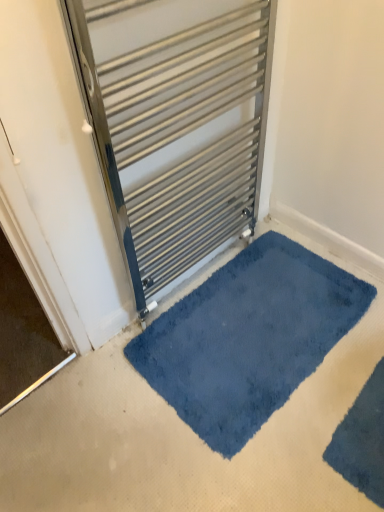
Question: Is velvety blue bath mat at lower right, which is the 1th bath mat from front to back, to the left of blue plush bath mat at center, which appears as the 1th bath mat when viewed from the back, from the viewer's perspective?

Choices:
 (A) yes
 (B) no

Answer: (B)

Question: Is blue plush bath mat at center, which appears as the 1th bath mat when viewed from the back, completely or partially inside velvety blue bath mat at lower right, which is the 1th bath mat from front to back?

Choices:
 (A) yes
 (B) no

Answer: (B)

Question: Can you confirm if velvety blue bath mat at lower right, which is the 1th bath mat from front to back, is smaller than blue plush bath mat at center, which ranks as the second bath mat in front-to-back order?

Choices:
 (A) no
 (B) yes

Answer: (B)

Question: Is velvety blue bath mat at lower right, positioned as the 2th bath mat in back-to-front order, next to blue plush bath mat at center, which ranks as the second bath mat in front-to-back order?

Choices:
 (A) no
 (B) yes

Answer: (A)

Question: Is velvety blue bath mat at lower right, positioned as the 2th bath mat in back-to-front order, outside of blue plush bath mat at center, which appears as the 1th bath mat when viewed from the back?

Choices:
 (A) yes
 (B) no

Answer: (A)

Question: Considering the relative sizes of velvety blue bath mat at lower right, positioned as the 2th bath mat in back-to-front order, and blue plush bath mat at center, which appears as the 1th bath mat when viewed from the back, in the image provided, is velvety blue bath mat at lower right, positioned as the 2th bath mat in back-to-front order, taller than blue plush bath mat at center, which appears as the 1th bath mat when viewed from the back,?

Choices:
 (A) yes
 (B) no

Answer: (B)

Question: Considering the relative sizes of velvety blue bath mat at lower right, positioned as the 2th bath mat in back-to-front order, and metallic silver radiator at center in the image provided, is velvety blue bath mat at lower right, positioned as the 2th bath mat in back-to-front order, taller than metallic silver radiator at center?

Choices:
 (A) yes
 (B) no

Answer: (B)

Question: Is velvety blue bath mat at lower right, which is the 1th bath mat from front to back, located outside metallic silver radiator at center?

Choices:
 (A) no
 (B) yes

Answer: (B)

Question: From the image's perspective, is velvety blue bath mat at lower right, which is the 1th bath mat from front to back, on top of metallic silver radiator at center?

Choices:
 (A) no
 (B) yes

Answer: (A)

Question: From the image's perspective, would you say velvety blue bath mat at lower right, positioned as the 2th bath mat in back-to-front order, is shown under metallic silver radiator at center?

Choices:
 (A) no
 (B) yes

Answer: (B)

Question: Is metallic silver radiator at center a part of velvety blue bath mat at lower right, which is the 1th bath mat from front to back?

Choices:
 (A) no
 (B) yes

Answer: (A)

Question: Is velvety blue bath mat at lower right, positioned as the 2th bath mat in back-to-front order, thinner than metallic silver radiator at center?

Choices:
 (A) no
 (B) yes

Answer: (A)

Question: Is metallic silver radiator at center beside velvety blue bath mat at lower right, positioned as the 2th bath mat in back-to-front order?

Choices:
 (A) no
 (B) yes

Answer: (A)